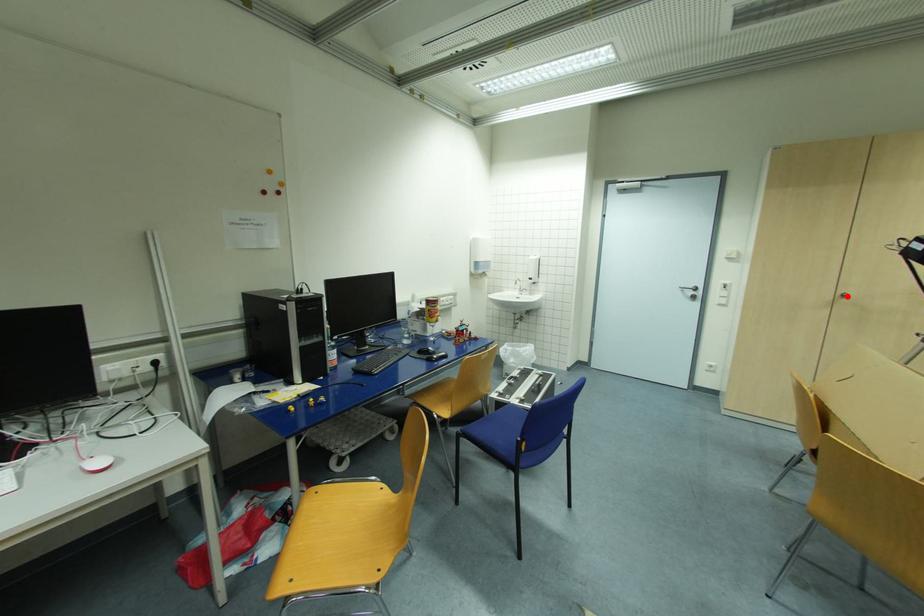
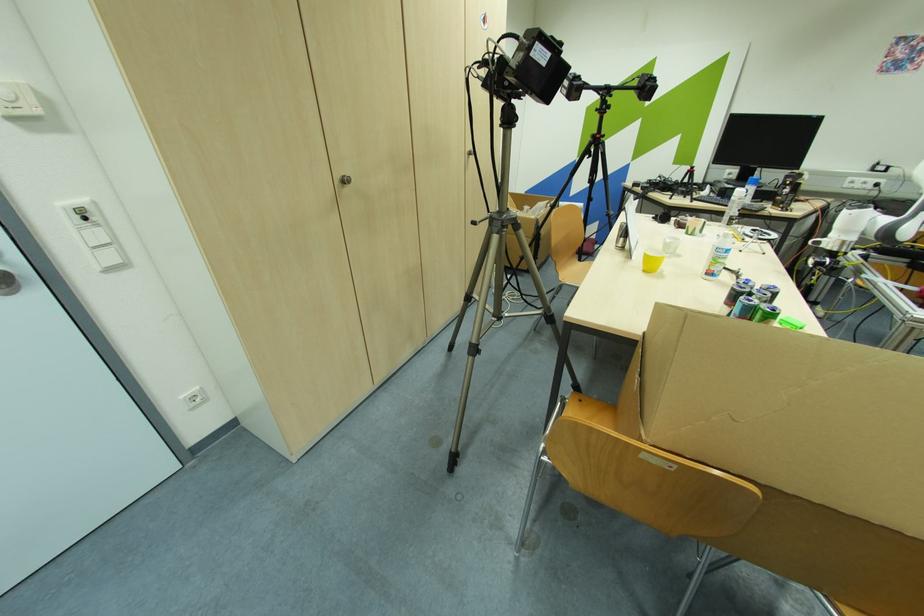
Question: I am providing you with two images of the same scene from different viewpoints. In image1, a red point is highlighted. Considering the same 3D point in image2, which of the following is correct?

Choices:
 (A) It is closer
 (B) It is farther

Answer: (A)